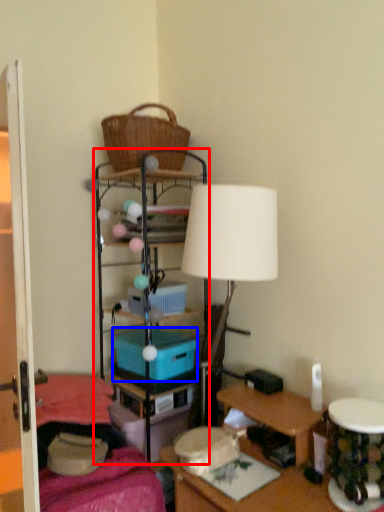
Question: Which of the following is the closest to the observer, shelf (highlighted by a red box) or storage box (highlighted by a blue box)?

Choices:
 (A) shelf
 (B) storage box

Answer: (A)